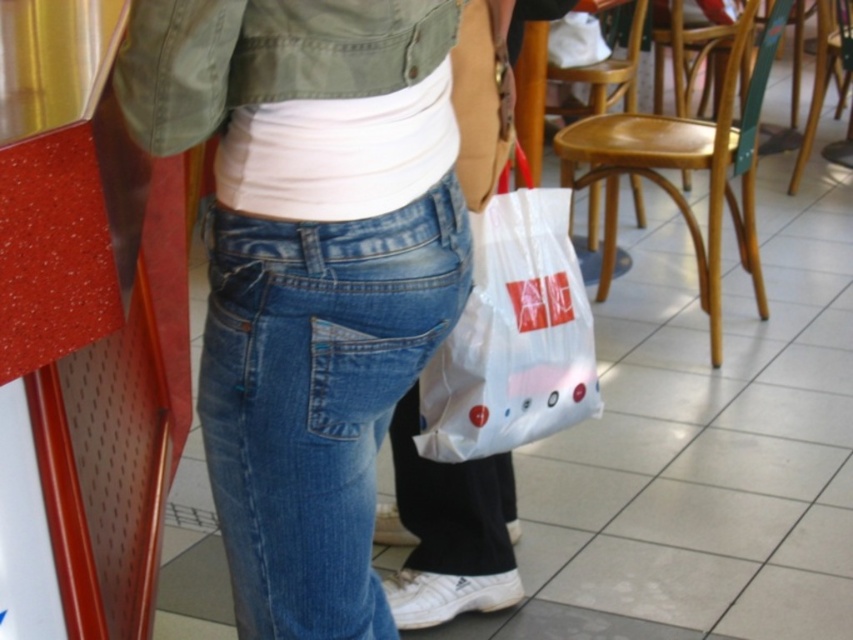
You are a delivery person who needs to place a small package on the floor next to the blue denim jeans at center and the white plastic bag at center. Which object should you place the package closer to so it doesn

The blue denim jeans at center is much taller than the white plastic bag at center, so placing the package closer to the blue denim jeans at center would ensure it is more visible and less likely to be knocked over.

You are a delivery robot in a shopping area. You need to deliver a package to the person wearing blue denim jeans at center. According to the coordinates provided, where should you aim to deliver the package?

The blue denim jeans at center are located at point (316,397), so you should aim to deliver the package to that coordinate.

You are an interior designer assessing the space for a new display. You notice the blue denim jeans at center and the white plastic bag at center. Which object is wider in the image?

The white plastic bag at center is wider than the blue denim jeans at center.